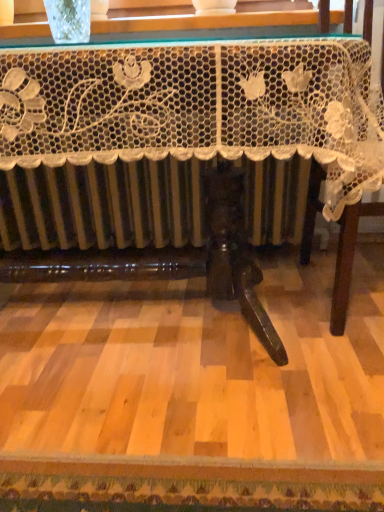
Question: Is white lace tablecloth at right taller or shorter than white lace tablecloth at center?

Choices:
 (A) tall
 (B) short

Answer: (A)

Question: From the image's perspective, is white lace tablecloth at right located above or below white lace tablecloth at center?

Choices:
 (A) above
 (B) below

Answer: (A)

Question: Which is correct: white lace tablecloth at right is inside white lace tablecloth at center, or outside of it?

Choices:
 (A) outside
 (B) inside

Answer: (A)

Question: From a real-world perspective, is white lace tablecloth at center positioned above or below white lace tablecloth at right?

Choices:
 (A) above
 (B) below

Answer: (B)

Question: Looking at the image, does white lace tablecloth at center seem bigger or smaller compared to white lace tablecloth at right?

Choices:
 (A) small
 (B) big

Answer: (B)

Question: From the image's perspective, is white lace tablecloth at center located above or below white lace tablecloth at right?

Choices:
 (A) below
 (B) above

Answer: (A)

Question: In terms of width, does white lace tablecloth at center look wider or thinner when compared to white lace tablecloth at right?

Choices:
 (A) wide
 (B) thin

Answer: (A)